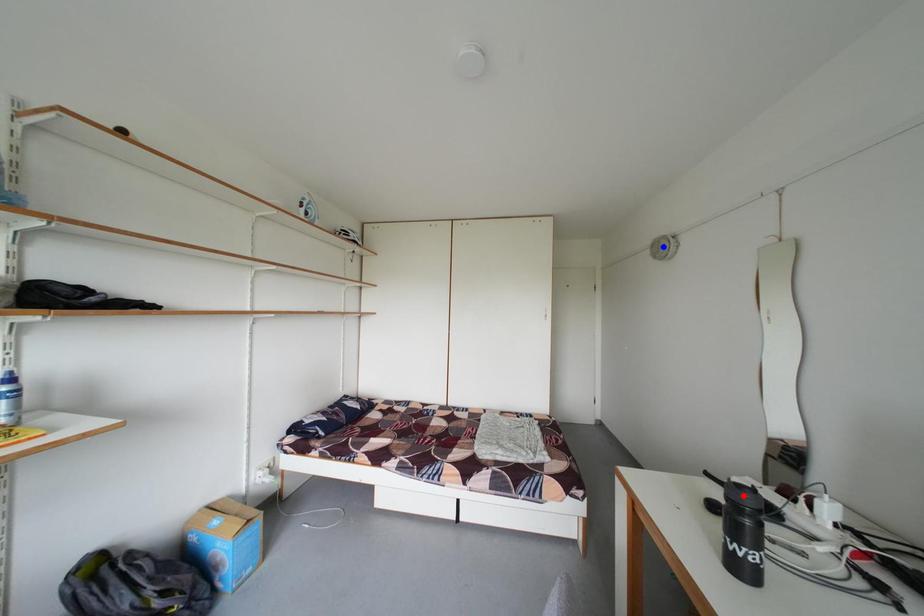
Question: Which of the two points in the image is closer to the camera?

Choices:
 (A) Blue point is closer.
 (B) Red point is closer.

Answer: (B)